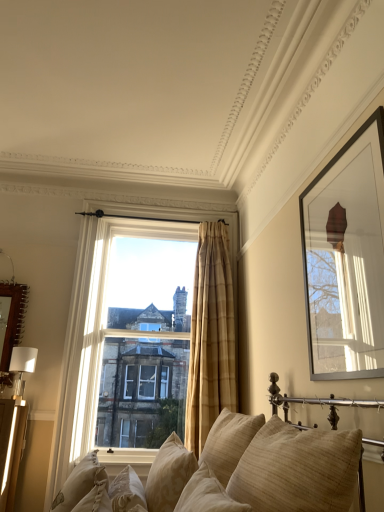
Question: In terms of height, does wooden mirror at left, which is the 1th picture frame in back-to-front order, look taller or shorter compared to beige fabric couch at center?

Choices:
 (A) tall
 (B) short

Answer: (A)

Question: Relative to beige fabric couch at center, is wooden mirror at left, which is counted as the second picture frame, starting from the right, in front or behind?

Choices:
 (A) behind
 (B) front

Answer: (A)

Question: Which object is positioned closest to the beige fabric couch at center?

Choices:
 (A) matte black picture frame at upper right, marked as the first picture frame in a front-to-back arrangement
 (B) beige textured pillow at lower center, which appears as the fourth pillow when viewed from the left
 (C) wooden mirror at left, acting as the 1th picture frame starting from the left
 (D) clear glass window at center
 (E) beige textured pillow at lower center, which appears as the 6th pillow when viewed from the left

Answer: (E)

Question: Estimate the real-world distances between objects in this image. Which object is farther from the beige fabric couch at center?

Choices:
 (A) beige textured pillow at lower center, acting as the 4th pillow starting from the right
 (B) clear glass window at center
 (C) beige textured pillow at center, the 5th pillow when ordered from left to right
 (D) wooden mirror at left, acting as the 1th picture frame starting from the left
 (E) beige textured pillow at lower left, the 6th pillow in the right-to-left sequence

Answer: (D)